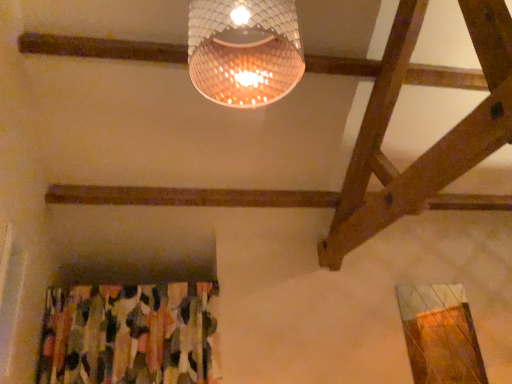
Question: From the image's perspective, is abstract fabric curtain at lower left positioned above or below translucent woven lampshade at upper center?

Choices:
 (A) below
 (B) above

Answer: (A)

Question: Is point (47, 324) closer or farther from the camera than point (254, 34)?

Choices:
 (A) farther
 (B) closer

Answer: (A)

Question: In the image, is abstract fabric curtain at lower left positioned in front of or behind translucent woven lampshade at upper center?

Choices:
 (A) behind
 (B) front

Answer: (A)

Question: In terms of width, does translucent woven lampshade at upper center look wider or thinner when compared to abstract fabric curtain at lower left?

Choices:
 (A) thin
 (B) wide

Answer: (B)

Question: From their relative heights in the image, would you say translucent woven lampshade at upper center is taller or shorter than abstract fabric curtain at lower left?

Choices:
 (A) short
 (B) tall

Answer: (A)

Question: Is translucent woven lampshade at upper center bigger or smaller than abstract fabric curtain at lower left?

Choices:
 (A) small
 (B) big

Answer: (A)

Question: Is translucent woven lampshade at upper center inside the boundaries of abstract fabric curtain at lower left, or outside?

Choices:
 (A) inside
 (B) outside

Answer: (B)